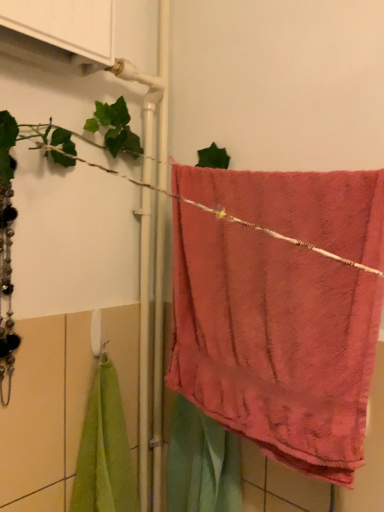
Question: Considering the relative sizes of white plastic towel bar at center and coral plush towel at center in the image provided, is white plastic towel bar at center thinner than coral plush towel at center?

Choices:
 (A) no
 (B) yes

Answer: (B)

Question: Is white plastic towel bar at center positioned in front of coral plush towel at center?

Choices:
 (A) yes
 (B) no

Answer: (B)

Question: Is the surface of white plastic towel bar at center in direct contact with coral plush towel at center?

Choices:
 (A) yes
 (B) no

Answer: (B)

Question: From a real-world perspective, is white plastic towel bar at center physically below coral plush towel at center?

Choices:
 (A) yes
 (B) no

Answer: (A)

Question: Is white plastic towel bar at center not within coral plush towel at center?

Choices:
 (A) yes
 (B) no

Answer: (A)

Question: Is white plastic towel bar at center positioned with its back to coral plush towel at center?

Choices:
 (A) yes
 (B) no

Answer: (B)

Question: Does coral plush towel at center have a greater width compared to white plastic towel bar at center?

Choices:
 (A) no
 (B) yes

Answer: (B)

Question: From a real-world perspective, is coral plush towel at center beneath white plastic towel bar at center?

Choices:
 (A) yes
 (B) no

Answer: (B)

Question: Is coral plush towel at center outside of white plastic towel bar at center?

Choices:
 (A) yes
 (B) no

Answer: (A)

Question: Considering the relative positions of coral plush towel at center and white plastic towel bar at center in the image provided, is coral plush towel at center in front of white plastic towel bar at center?

Choices:
 (A) yes
 (B) no

Answer: (A)

Question: Is coral plush towel at center positioned with its back to white plastic towel bar at center?

Choices:
 (A) yes
 (B) no

Answer: (B)

Question: Does coral plush towel at center turn towards white plastic towel bar at center?

Choices:
 (A) yes
 (B) no

Answer: (B)

Question: Is coral plush towel at center to the left or to the right of white plastic towel bar at center in the image?

Choices:
 (A) left
 (B) right

Answer: (B)